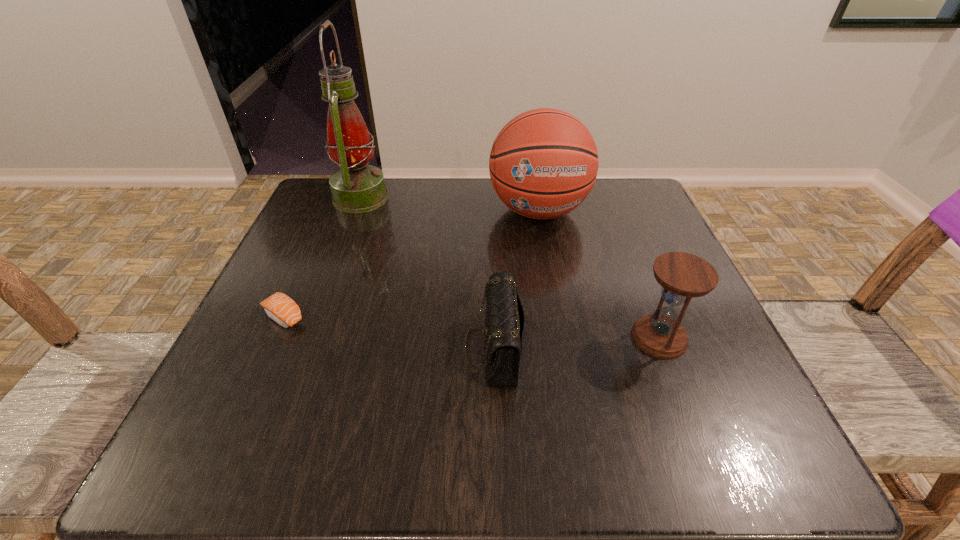
Locate an element on the screen. The image size is (960, 540). object positioned at the far right corner is located at coordinates (543, 163).

In the image, there is a desktop. Where is `vacant space at the far edge`? The height and width of the screenshot is (540, 960). vacant space at the far edge is located at coordinates (462, 187).

Find the location of a particular element. Image resolution: width=960 pixels, height=540 pixels. vacant space at the left edge of the desktop is located at coordinates (265, 388).

Where is `free region at the right edge`? This screenshot has width=960, height=540. free region at the right edge is located at coordinates (711, 333).

Find the location of a particular element. This screenshot has height=540, width=960. free space at the far right corner of the desktop is located at coordinates (627, 193).

Where is `free location at the near right corner of the desktop`? The height and width of the screenshot is (540, 960). free location at the near right corner of the desktop is located at coordinates (693, 425).

Find the location of a particular element. free space that is in between the fourth tallest object and the oil lamp is located at coordinates (427, 273).

Locate an element on the screen. The width and height of the screenshot is (960, 540). blank region between the second tallest object and the third tallest object is located at coordinates (599, 274).

What are the coordinates of `vacant area that lies between the sushi and the rightmost object` in the screenshot? It's located at (471, 327).

I want to click on free space between the tallest object and the hourglass, so click(510, 267).